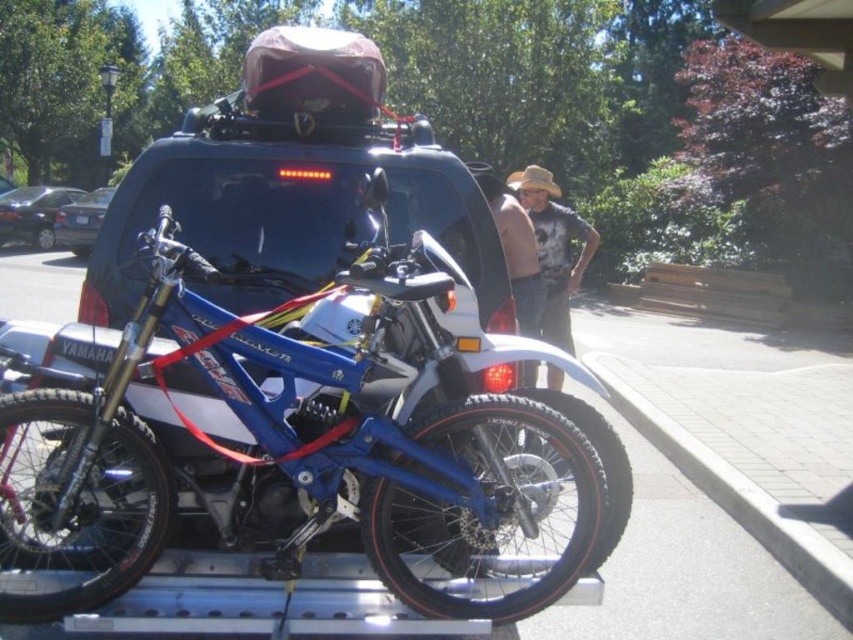
Is point (584, 230) less distant than point (534, 292)?

No, (584, 230) is further to viewer.

Can you confirm if denim shirt at center is positioned above tan straw hat at upper center?

Indeed, denim shirt at center is positioned over tan straw hat at upper center.

Which is in front, point (553, 243) or point (495, 195)?

Point (495, 195)

Find the location of a particular element. denim shirt at center is located at coordinates (554, 248).

Does denim shirt at center have a lesser width compared to shiny black sedan at left?

Yes, denim shirt at center is thinner than shiny black sedan at left.

Can you confirm if denim shirt at center is wider than shiny black sedan at left?

No, denim shirt at center is not wider than shiny black sedan at left.

Measure the distance between point [566,307] and camera.

The distance of point [566,307] from camera is 6.38 meters.

Where is `denim shirt at center`? denim shirt at center is located at coordinates (554, 248).

Is blue metallic motorcycle at center further to camera compared to shiny black sedan at left?

That is False.

Between blue metallic motorcycle at center and shiny black sedan at left, which one is positioned lower?

Positioned lower is blue metallic motorcycle at center.

Is point (67, 461) in front of point (9, 240)?

Yes, it is in front of point (9, 240).

Identify the location of blue metallic motorcycle at center. This screenshot has width=853, height=640. (291, 451).